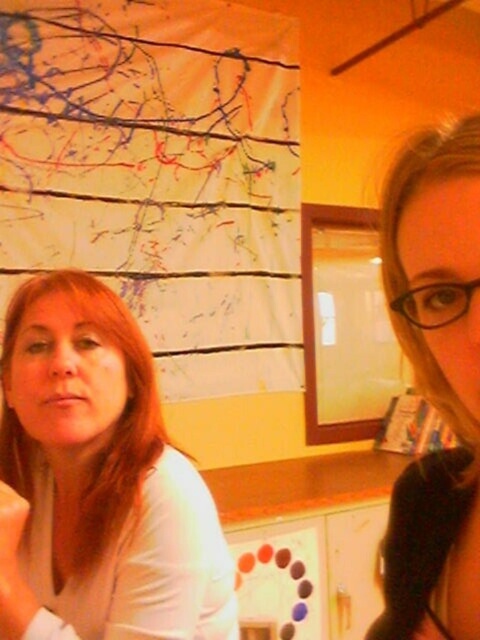
Question: Which point is farther from the camera taking this photo?

Choices:
 (A) (55, 397)
 (B) (457, 244)

Answer: (A)

Question: Is smooth beige shirt at left to the left of smooth blonde hair at center from the viewer's perspective?

Choices:
 (A) yes
 (B) no

Answer: (A)

Question: Which of the following is the farthest from the observer?

Choices:
 (A) smooth beige shirt at left
 (B) smooth blonde hair at center

Answer: (A)

Question: Is smooth beige shirt at left behind smooth blonde hair at center?

Choices:
 (A) no
 (B) yes

Answer: (B)

Question: Is smooth beige shirt at left bigger than smooth blonde hair at center?

Choices:
 (A) yes
 (B) no

Answer: (A)